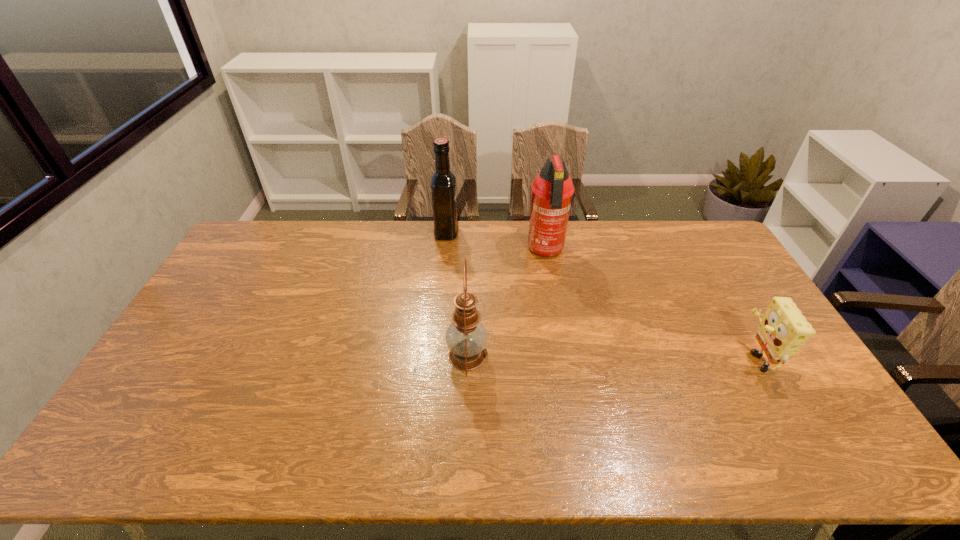
The image size is (960, 540). In order to click on vacant area at the near right corner of the desktop in this screenshot , I will do `click(820, 453)`.

Locate an element on the screen. This screenshot has height=540, width=960. free spot between the oil lamp and the liquor is located at coordinates (457, 294).

You are a GUI agent. You are given a task and a screenshot of the screen. Output one action in this format:
    pyautogui.click(x=<x>, y=<y>)
    Task: Click on the free space between the oil lamp and the sponge
    The image size is (960, 540).
    Given the screenshot: What is the action you would take?
    pyautogui.click(x=611, y=356)

This screenshot has width=960, height=540. In order to click on vacant area that lies between the shortest object and the second object from right to left in this screenshot , I will do `click(650, 304)`.

Where is `free space between the fire extinguisher and the liquor`? The width and height of the screenshot is (960, 540). free space between the fire extinguisher and the liquor is located at coordinates (496, 242).

At what (x,y) coordinates should I click in order to perform the action: click on free space between the second object from right to left and the shortest object. Please return your answer as a coordinate pair (x, y). The image size is (960, 540). Looking at the image, I should click on (650, 304).

Locate an element on the screen. The height and width of the screenshot is (540, 960). free space between the liquor and the oil lamp is located at coordinates (457, 294).

The image size is (960, 540). Identify the location of free area in between the second object from right to left and the sponge. (650, 304).

Identify the location of unoccupied area between the liquor and the sponge. The width and height of the screenshot is (960, 540). (600, 295).

Identify the location of free spot between the liquor and the oil lamp. This screenshot has width=960, height=540. (457, 294).